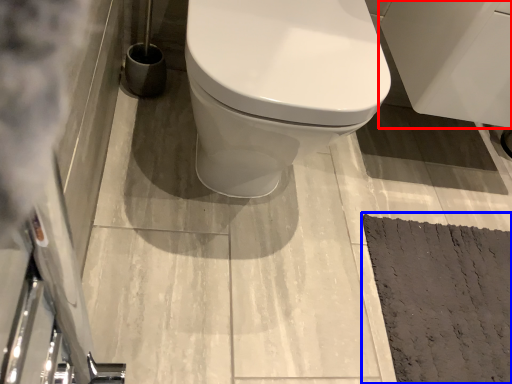
Question: Which object appears closest to the camera in this image, porcelain (highlighted by a red box) or doormat (highlighted by a blue box)?

Choices:
 (A) porcelain
 (B) doormat

Answer: (A)